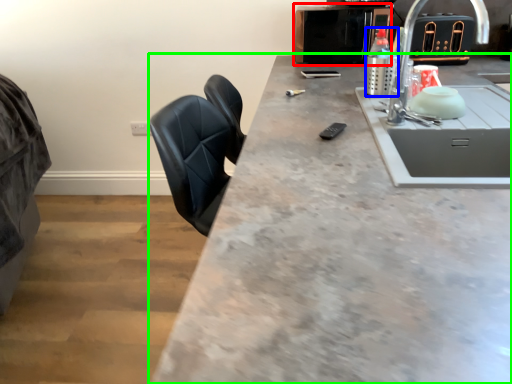
Question: Considering the real-world distances, which object is farthest from appliance (highlighted by a red box)? bottle (highlighted by a blue box) or countertop (highlighted by a green box)?

Choices:
 (A) bottle
 (B) countertop

Answer: (B)